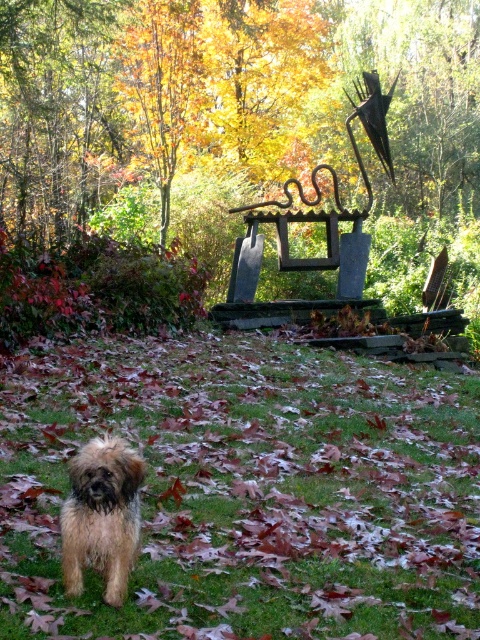
How distant is green grass at center from fuzzy brown dog at lower left?

green grass at center is 16.47 inches from fuzzy brown dog at lower left.

This screenshot has height=640, width=480. Describe the element at coordinates (249, 490) in the screenshot. I see `green grass at center` at that location.

Find the location of a particular element. green grass at center is located at coordinates (249, 490).